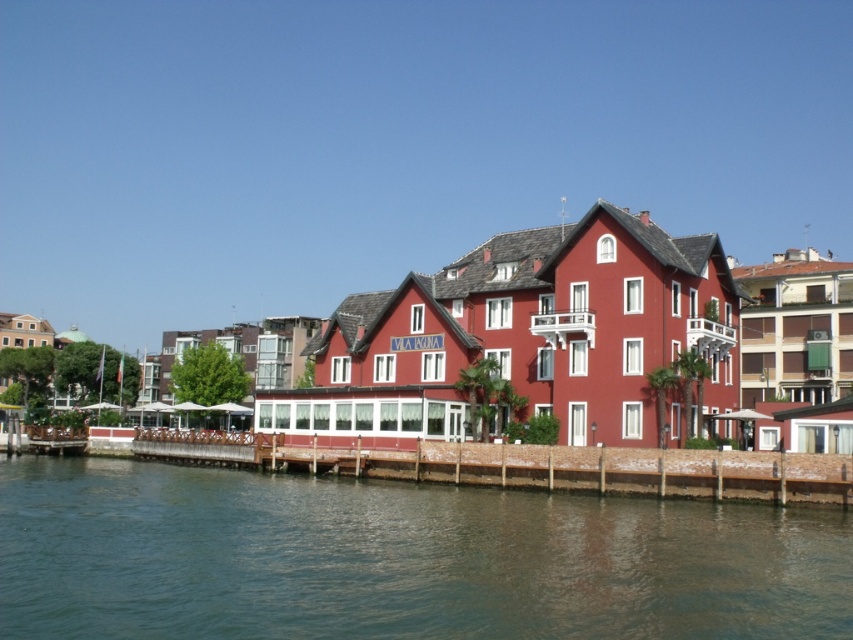
Can you confirm if greenish water at lower center is positioned above brown wooden dock at lower center?

No, greenish water at lower center is not above brown wooden dock at lower center.

Is greenish water at lower center below brown wooden dock at lower center?

Indeed, greenish water at lower center is positioned under brown wooden dock at lower center.

Who is more distant from viewer, (39, 582) or (192, 436)?

The point (192, 436) is behind.

Locate an element on the screen. greenish water at lower center is located at coordinates (399, 560).

Is brown wooden dock at lower center positioned before wooden dock at lower left?

Yes.

Is point (248, 444) closer to viewer compared to point (54, 451)?

Yes, it is.

Locate an element on the screen. The height and width of the screenshot is (640, 853). brown wooden dock at lower center is located at coordinates (531, 467).

Is matte red building at center below wooden dock at lower left?

No.

Who is taller, matte red building at center or wooden dock at lower left?

matte red building at center

Is point (634, 433) more distant than point (39, 436)?

No, (634, 433) is closer to viewer.

Image resolution: width=853 pixels, height=640 pixels. What are the coordinates of `matte red building at center` in the screenshot? It's located at (527, 337).